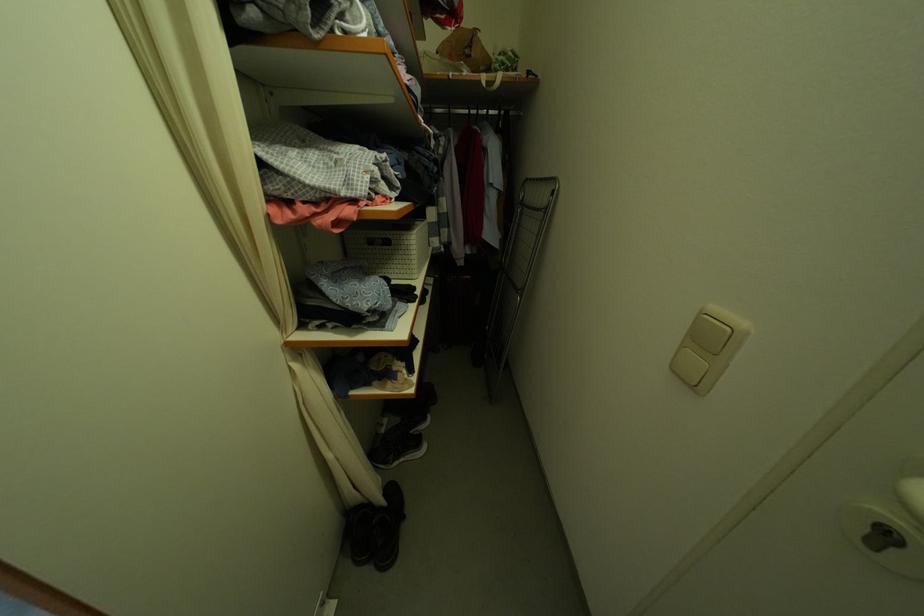
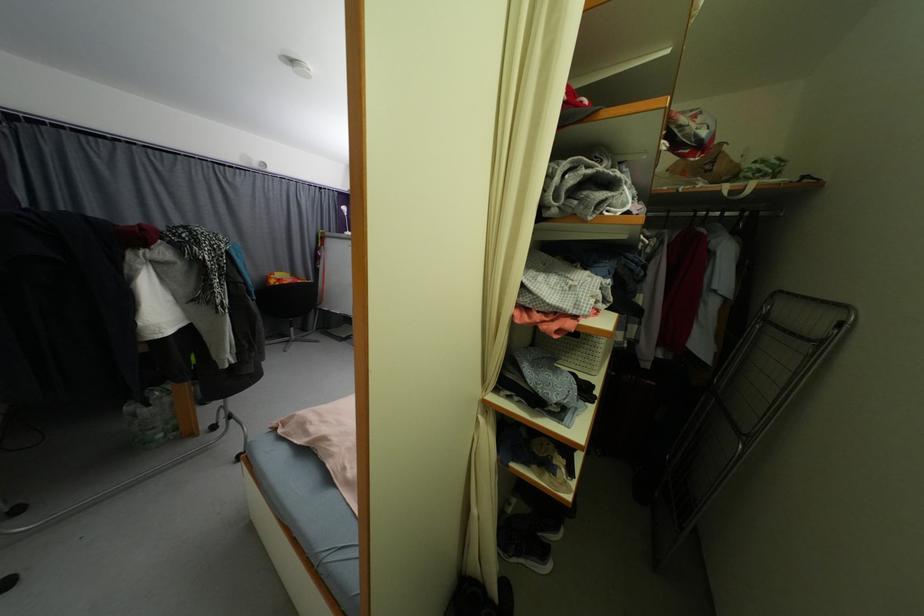
Question: The images are taken continuously from a first-person perspective. In which direction is your viewpoint rotating?

Choices:
 (A) Left
 (B) Right
 (C) Up
 (D) Down

Answer: (A)